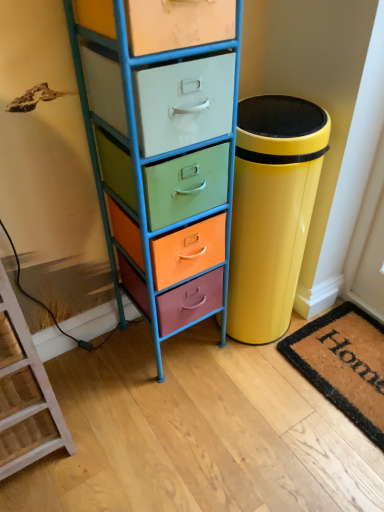
This screenshot has width=384, height=512. I want to click on vacant region under metallic multi-colored chest of drawers at left (from a real-world perspective), so click(x=172, y=349).